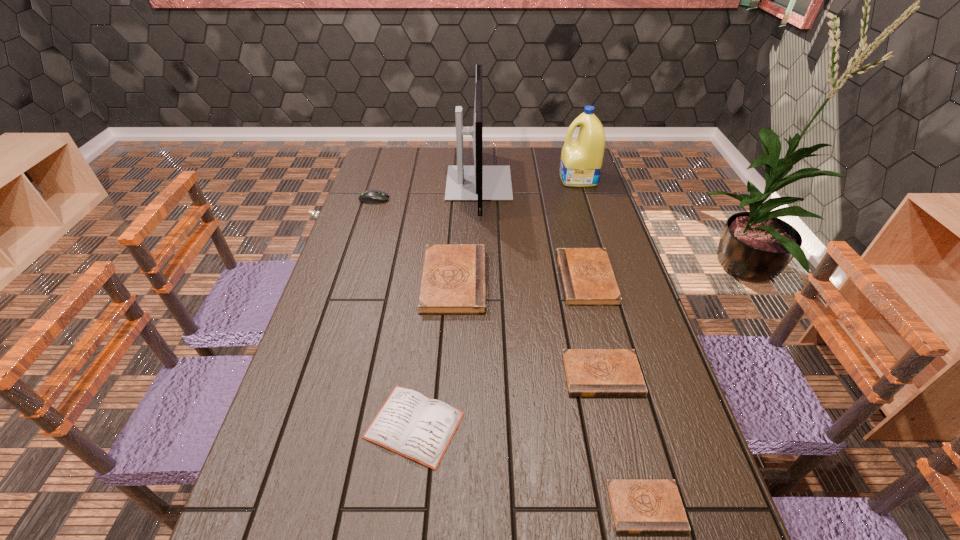
Find the location of a particular element. The image size is (960, 540). vacant region located 0.370m on the spine side of the third smallest brown diary is located at coordinates (437, 279).

This screenshot has height=540, width=960. I want to click on vacant space located 0.080m on the spine side of the third smallest brown diary, so click(534, 279).

Locate an element on the screen. free region located 0.200m on the spine side of the second smallest brown diary is located at coordinates (628, 485).

You are a GUI agent. You are given a task and a screenshot of the screen. Output one action in this format:
    pyautogui.click(x=<x>, y=<y>)
    Task: Click on the vacant space positioned on the front of the white diary
    This screenshot has height=540, width=960.
    Given the screenshot: What is the action you would take?
    pyautogui.click(x=403, y=518)

I want to click on computer monitor located at the far edge, so click(479, 183).

Where is `detergent that is at the far edge`? This screenshot has height=540, width=960. detergent that is at the far edge is located at coordinates (581, 159).

Image resolution: width=960 pixels, height=540 pixels. In order to click on object located in the left edge section of the desktop in this screenshot , I will do `click(372, 196)`.

Where is `detergent that is positioned at the right edge`? detergent that is positioned at the right edge is located at coordinates (581, 159).

The width and height of the screenshot is (960, 540). I want to click on object that is at the far right corner, so click(x=581, y=159).

You are a GUI agent. You are given a task and a screenshot of the screen. Output one action in this format:
    pyautogui.click(x=<x>, y=<y>)
    Task: Click on the vacant space at the far edge
    This screenshot has height=540, width=960.
    Given the screenshot: What is the action you would take?
    pyautogui.click(x=455, y=161)